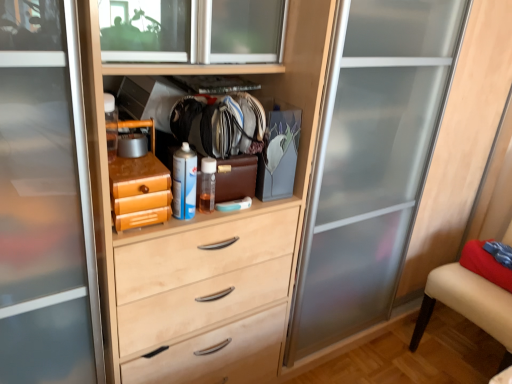
Where is `beige fabric armchair at right`? beige fabric armchair at right is located at coordinates (468, 304).

Describe the element at coordinates (468, 304) in the screenshot. I see `beige fabric armchair at right` at that location.

I want to click on blue matte spray can at center, so click(184, 182).

What do you see at coordinates (184, 182) in the screenshot?
I see `blue matte spray can at center` at bounding box center [184, 182].

Where is `beige fabric armchair at right`? The image size is (512, 384). beige fabric armchair at right is located at coordinates pos(468,304).

Is blue matte spray can at center at the left side of beige fabric armchair at right?

Indeed, blue matte spray can at center is positioned on the left side of beige fabric armchair at right.

Is the depth of blue matte spray can at center greater than that of beige fabric armchair at right?

No, it is not.

Between point (184, 173) and point (425, 304), which one is positioned behind?

The point (425, 304) is farther from the camera.

From the image's perspective, which object appears higher, blue matte spray can at center or beige fabric armchair at right?

blue matte spray can at center.

From a real-world perspective, relative to beige fabric armchair at right, is blue matte spray can at center vertically above or below?

blue matte spray can at center is above beige fabric armchair at right.

Which object is thinner, blue matte spray can at center or beige fabric armchair at right?

blue matte spray can at center.

Can you confirm if blue matte spray can at center is taller than beige fabric armchair at right?

In fact, blue matte spray can at center may be shorter than beige fabric armchair at right.

Between blue matte spray can at center and beige fabric armchair at right, which one has smaller size?

Smaller between the two is blue matte spray can at center.

Is blue matte spray can at center inside the boundaries of beige fabric armchair at right, or outside?

blue matte spray can at center lies outside beige fabric armchair at right.

Are blue matte spray can at center and beige fabric armchair at right far apart?

blue matte spray can at center is far away from beige fabric armchair at right.

Could you tell me if blue matte spray can at center is facing beige fabric armchair at right?

No.

How many degrees apart are the facing directions of blue matte spray can at center and beige fabric armchair at right?

The facing directions of blue matte spray can at center and beige fabric armchair at right are 90.1 degrees apart.

At what (x,y) coordinates should I click in order to perform the action: click on armchair that appears below the blue matte spray can at center (from a real-world perspective). Please return your answer as a coordinate pair (x, y). The height and width of the screenshot is (384, 512). Looking at the image, I should click on (468, 304).

Is beige fabric armchair at right at the right side of blue matte spray can at center?

Yes.

Is the position of beige fabric armchair at right more distant than that of blue matte spray can at center?

Yes, beige fabric armchair at right is behind blue matte spray can at center.

Is point (501, 340) behind point (189, 172)?

Yes, it is.

From the image's perspective, is beige fabric armchair at right located above or below blue matte spray can at center?

From the image's perspective, beige fabric armchair at right appears below blue matte spray can at center.

From a real-world perspective, is beige fabric armchair at right physically located above or below blue matte spray can at center?

Clearly, from a real-world perspective, beige fabric armchair at right is below blue matte spray can at center.

Between beige fabric armchair at right and blue matte spray can at center, which one has smaller width?

With smaller width is blue matte spray can at center.

Can you confirm if beige fabric armchair at right is taller than blue matte spray can at center?

Yes.

Considering the relative sizes of beige fabric armchair at right and blue matte spray can at center in the image provided, is beige fabric armchair at right bigger than blue matte spray can at center?

Yes, beige fabric armchair at right is bigger than blue matte spray can at center.

Do you think beige fabric armchair at right is within blue matte spray can at center, or outside of it?

beige fabric armchair at right is spatially situated outside blue matte spray can at center.

Is beige fabric armchair at right touching blue matte spray can at center?

No, beige fabric armchair at right is not with blue matte spray can at center.

Is beige fabric armchair at right facing towards blue matte spray can at center?

Yes, beige fabric armchair at right faces towards blue matte spray can at center.

How many degrees apart are the facing directions of beige fabric armchair at right and blue matte spray can at center?

They differ by 90.1 degrees in their facing directions.

The height and width of the screenshot is (384, 512). I want to click on armchair behind the blue matte spray can at center, so click(468, 304).

The height and width of the screenshot is (384, 512). Find the location of `bottle in front of the beige fabric armchair at right`. bottle in front of the beige fabric armchair at right is located at coordinates 184,182.

At what (x,y) coordinates should I click in order to perform the action: click on bottle above the beige fabric armchair at right (from the image's perspective). Please return your answer as a coordinate pair (x, y). The height and width of the screenshot is (384, 512). Looking at the image, I should click on (184, 182).